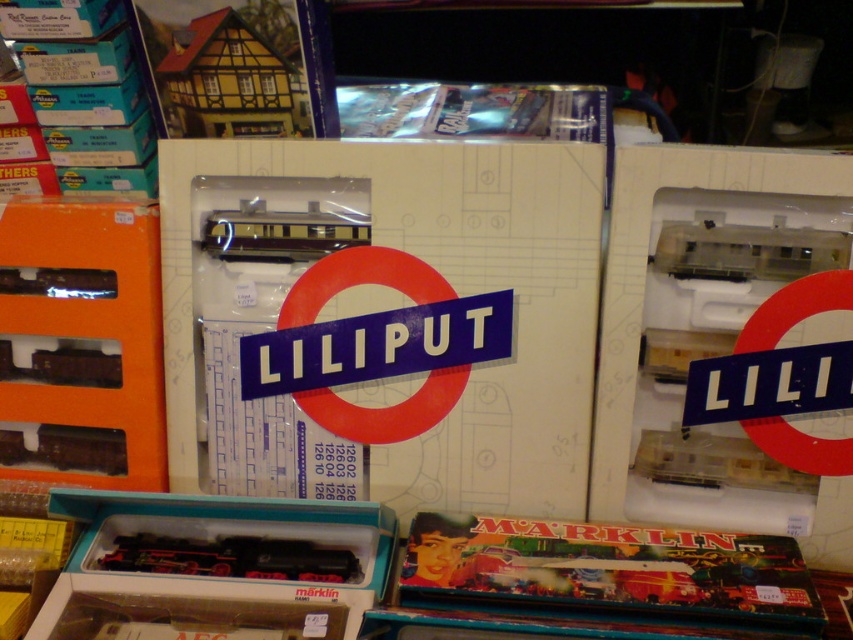
You are a customer browsing a toy store and see the orange matte train set at left and the yellow wood house at upper left. Which object is positioned lower in the image?

The orange matte train set at left is located below the yellow wood house at upper left, so it is positioned lower in the image.

You are a collector looking to purchase a model train set. You notice the orange matte train set at left and the yellow wood house at upper left in the display. Which item is closer to you as you examine the display?

The orange matte train set at left is closer to you than the yellow wood house at upper left because it is positioned further to the viewer.

You are a toy store employee who needs to place the transparent plastic train at center into the white cardboard box at center. Can you fit the train into the box without any adjustments?

The white cardboard box at center and transparent plastic train at center are 8.61 inches apart from each other. Since the distance between them is significant, the train may not fit into the box without adjustments. You might need to reposition or reduce the size of the train to accommodate the box.